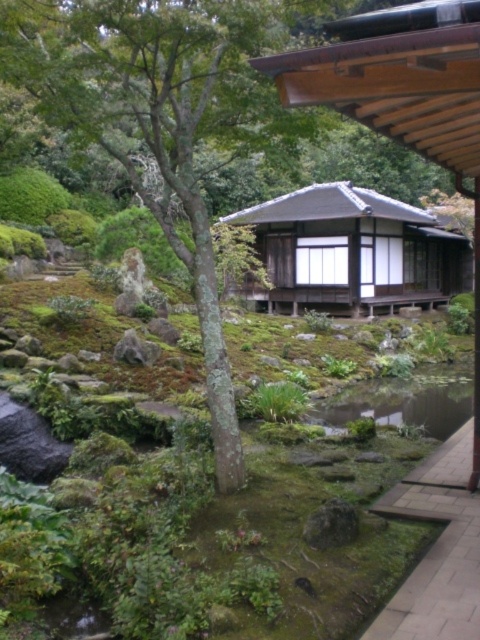
Question: Which point is farther to the camera?

Choices:
 (A) paved stone path at lower right
 (B) green mossy stream at center

Answer: (B)

Question: Is paved stone path at lower right bigger than green mossy stream at center?

Choices:
 (A) no
 (B) yes

Answer: (B)

Question: Can you confirm if paved stone path at lower right is positioned to the right of green mossy stream at center?

Choices:
 (A) no
 (B) yes

Answer: (A)

Question: Which of the following is the closest to the observer?

Choices:
 (A) (430, 563)
 (B) (417, 388)

Answer: (A)

Question: Is paved stone path at lower right smaller than green mossy stream at center?

Choices:
 (A) yes
 (B) no

Answer: (B)

Question: Which of the following is the closest to the observer?

Choices:
 (A) (386, 396)
 (B) (432, 579)

Answer: (B)